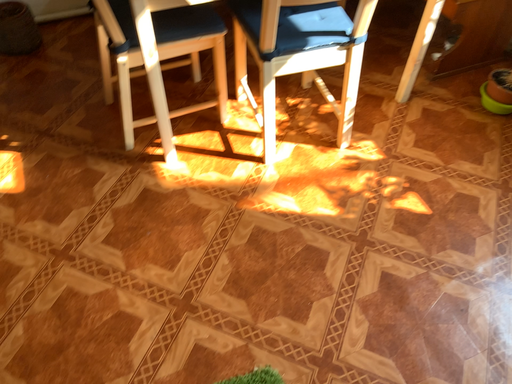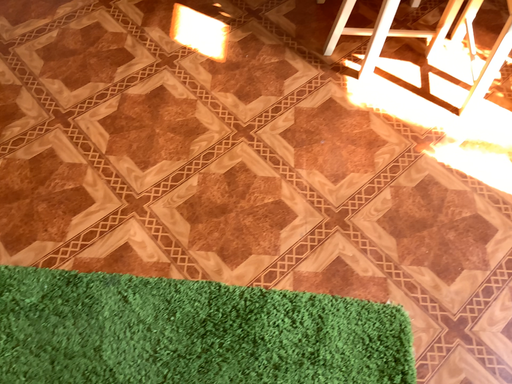
Question: Which way did the camera rotate in the video?

Choices:
 (A) rotated left
 (B) rotated right

Answer: (A)